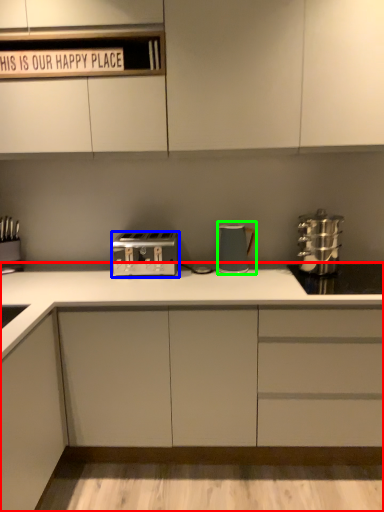
Question: Which object is positioned farthest from cabinetry (highlighted by a red box)? Select from toaster (highlighted by a blue box) and kitchen appliance (highlighted by a green box).

Choices:
 (A) toaster
 (B) kitchen appliance

Answer: (B)